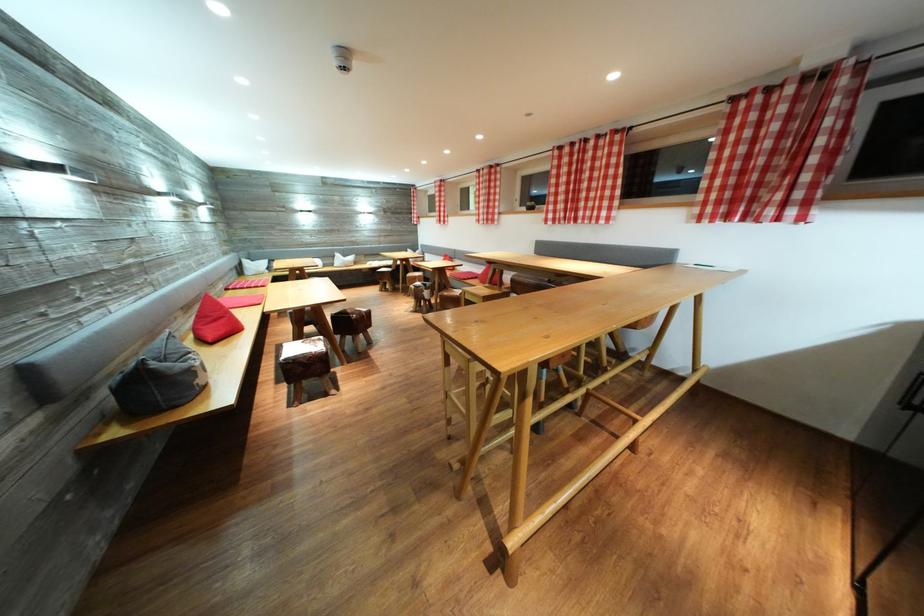
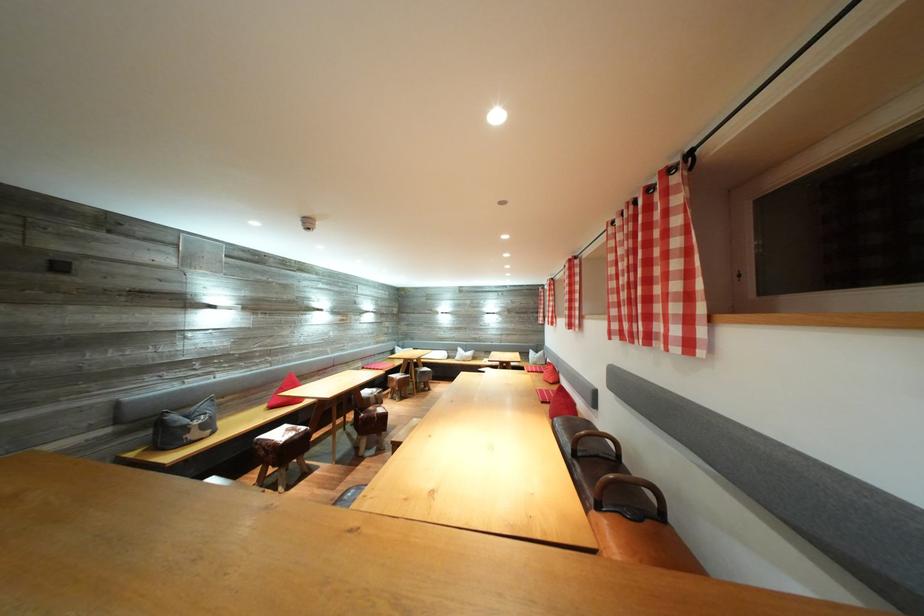
Locate, in the second image, the point that corresponds to point 371,315 in the first image.

(386, 416)